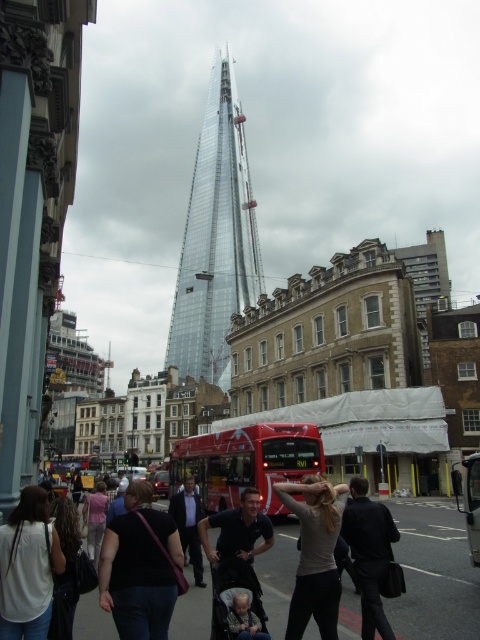
You are a delivery person who needs to hand over a package to the owner of the black leather jacket at lower right and the dark brown leather jacket at lower left. However, you can only approach one of them without moving any objects. Which jacket owner can you reach directly without moving anything?

The dark brown leather jacket at lower left is behind the black leather jacket at lower right. Therefore, you can directly reach the owner of the black leather jacket at lower right without moving anything, but you cannot reach the dark brown leather jacket at lower left because it is obstructed by the black one.

You are standing in the bustling urban scene looking at the construction site. There are two points marked on the image, one at coordinates point (x=240, y=554) and the other at point (x=190, y=515). Which point is closer to your current position?

Point (x=240, y=554) is closer to the camera than point (x=190, y=515), so the point at coordinates point (x=240, y=554) is closer to your current position.